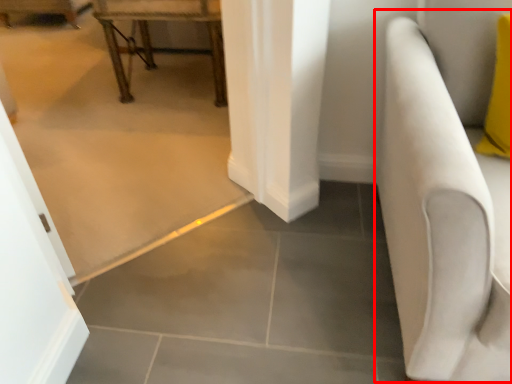
Question: From the image's perspective, what is the correct spatial relationship of armchair (annotated by the red box) in relation to furniture?

Choices:
 (A) below
 (B) above

Answer: (A)